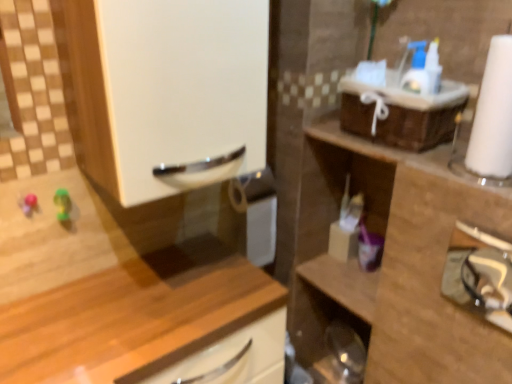
The width and height of the screenshot is (512, 384). Find the location of `vacant point above wooden cabinet at lower left, marked as the first cabinetry in a left-to-right arrangement (from a real-world perspective)`. vacant point above wooden cabinet at lower left, marked as the first cabinetry in a left-to-right arrangement (from a real-world perspective) is located at coordinates (135, 316).